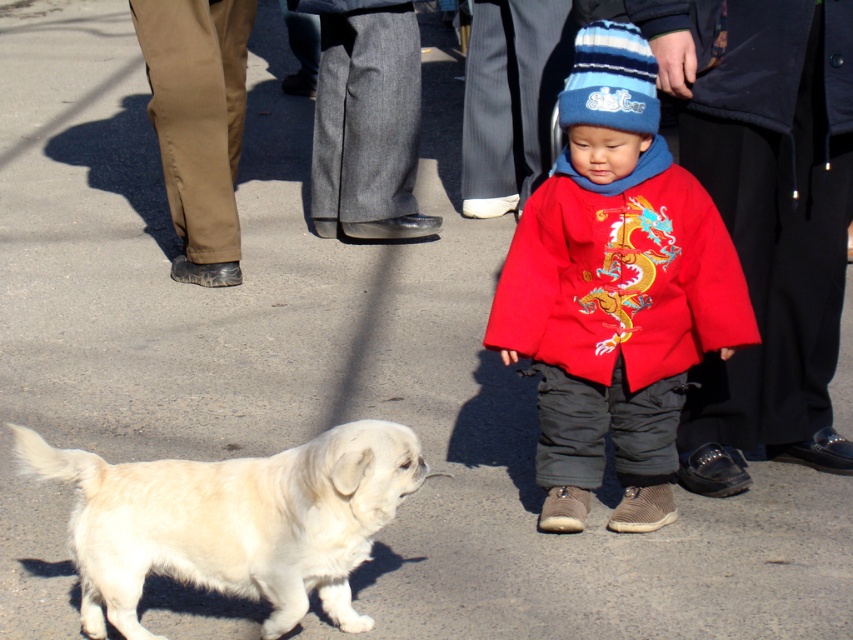
Question: Is light beige fur at lower left further to the viewer compared to blue knitted hat at center?

Choices:
 (A) yes
 (B) no

Answer: (B)

Question: Does light beige fur at lower left have a lesser width compared to blue knitted hat at center?

Choices:
 (A) no
 (B) yes

Answer: (A)

Question: Which of the following is the farthest from the observer?

Choices:
 (A) (601, 29)
 (B) (399, 467)
 (C) (550, 374)

Answer: (C)

Question: Can you confirm if red matte coat at center is thinner than light beige fur at lower left?

Choices:
 (A) yes
 (B) no

Answer: (A)

Question: Which point appears farthest from the camera in this image?

Choices:
 (A) (619, 100)
 (B) (672, 216)

Answer: (B)

Question: Among these points, which one is nearest to the camera?

Choices:
 (A) (666, 216)
 (B) (604, 22)

Answer: (B)